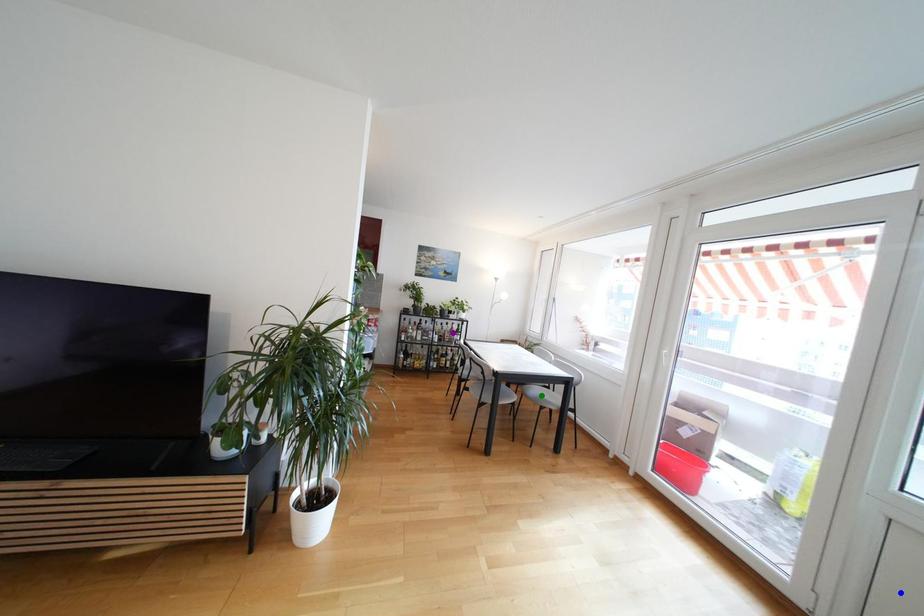
Order these from nearest to farthest:
1. green point
2. purple point
3. blue point

purple point < green point < blue point